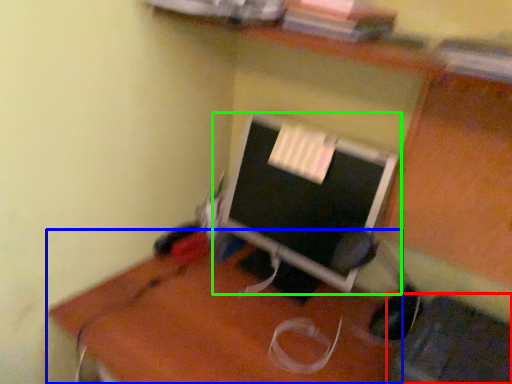
Question: Which object is the closest to the computer chair (highlighted by a red box)? Choose among these: desk (highlighted by a blue box) or computer monitor (highlighted by a green box).

Choices:
 (A) desk
 (B) computer monitor

Answer: (A)